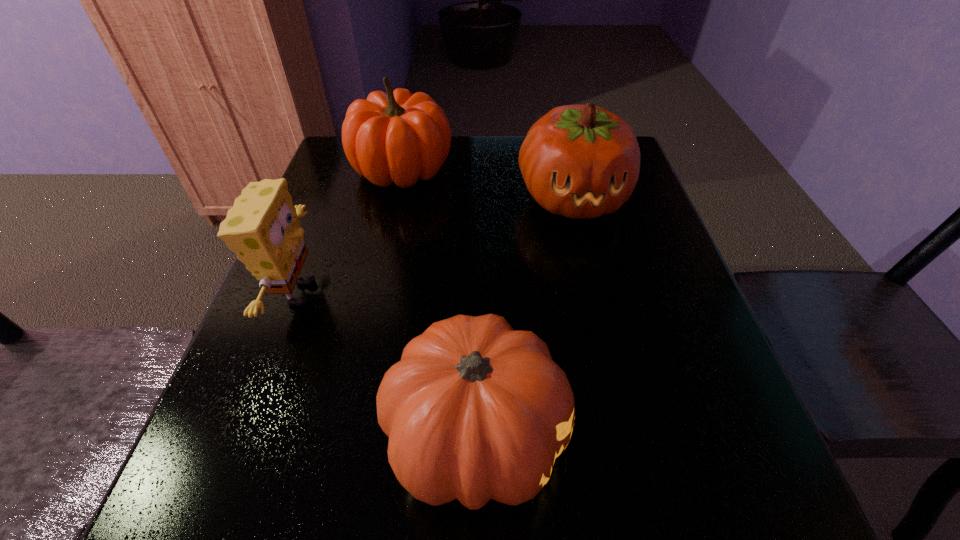
The height and width of the screenshot is (540, 960). In order to click on object located in the far right corner section of the desktop in this screenshot , I will do `click(580, 161)`.

In the image, there is a desktop. Identify the location of blank space at the far edge. This screenshot has height=540, width=960. (520, 183).

Find the location of a particular element. This screenshot has width=960, height=540. free region at the near edge is located at coordinates (x=462, y=510).

What are the coordinates of `vacant space at the left edge` in the screenshot? It's located at (320, 382).

Where is `blank area at the right edge`? The image size is (960, 540). blank area at the right edge is located at coordinates (633, 254).

Image resolution: width=960 pixels, height=540 pixels. I want to click on blank space at the far left corner of the desktop, so click(x=344, y=150).

Where is `vacant space that's between the shortest pumpkin and the sponge`? vacant space that's between the shortest pumpkin and the sponge is located at coordinates (388, 366).

I want to click on vacant region between the nearest pumpkin and the sponge, so click(388, 366).

The height and width of the screenshot is (540, 960). Identify the location of the second closest object relative to the sponge. (398, 137).

Identify which object is located as the third nearest to the shortest pumpkin. Please provide its 2D coordinates. Your answer should be formatted as a tuple, i.e. [(x, y)], where the tuple contains the x and y coordinates of a point satisfying the conditions above.

[(398, 137)]